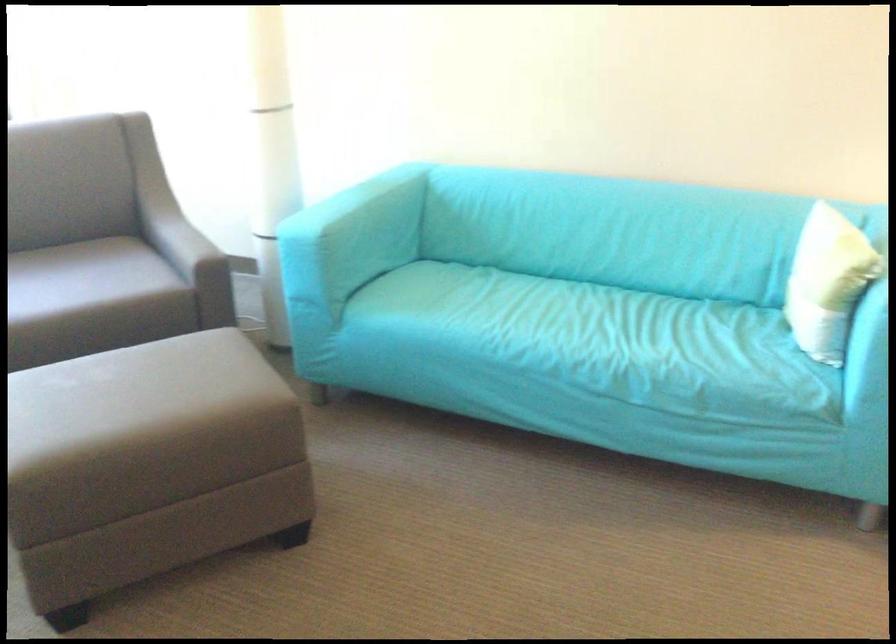
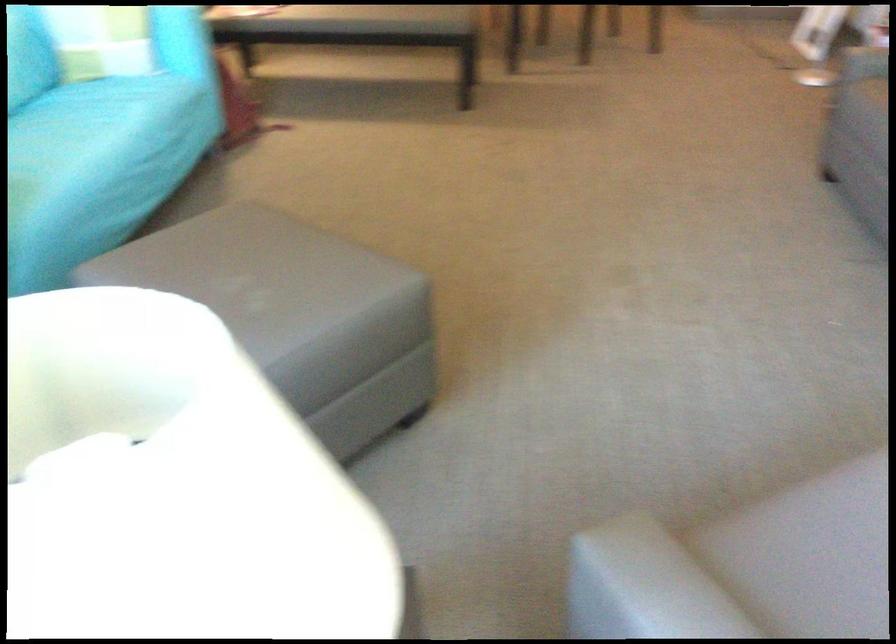
In the second image, find the point that corresponds to the point at 536,323 in the first image.

(87, 134)